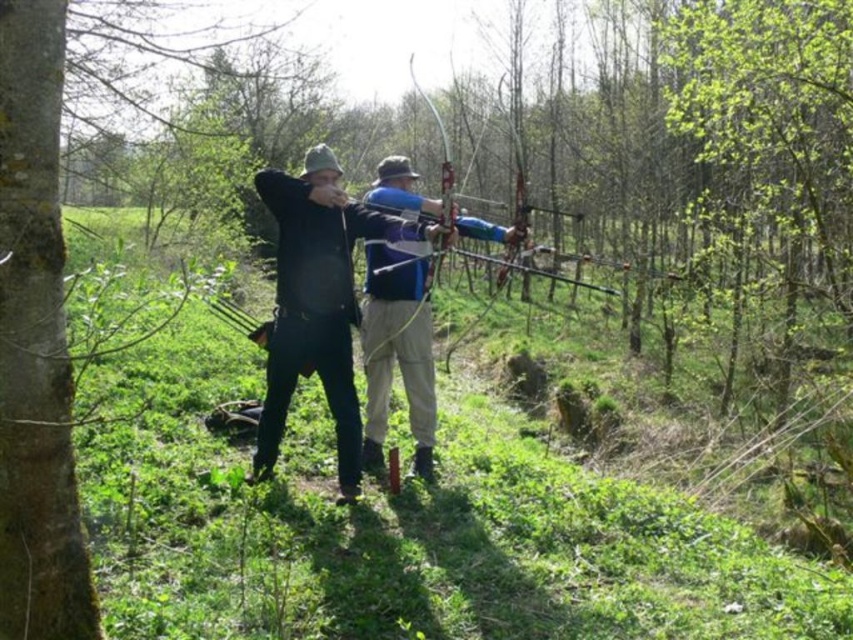
Does black matte jacket at center have a lesser width compared to matte blue bow at center?

Yes, black matte jacket at center is thinner than matte blue bow at center.

Does black matte jacket at center lie behind matte blue bow at center?

That is True.

Which is behind, point (312, 323) or point (573, 257)?

The point (573, 257) is more distant.

Find the location of a particular element. The image size is (853, 640). black matte jacket at center is located at coordinates (317, 301).

Can you confirm if blue fabric bow at center is positioned to the right of matte blue bow at center?

No, blue fabric bow at center is not to the right of matte blue bow at center.

I want to click on blue fabric bow at center, so click(x=398, y=348).

Looking at this image, is black matte jacket at center to the left of blue fabric bow at center from the viewer's perspective?

Indeed, black matte jacket at center is positioned on the left side of blue fabric bow at center.

Is black matte jacket at center shorter than blue fabric bow at center?

Indeed, black matte jacket at center has a lesser height compared to blue fabric bow at center.

Is point (316, 218) behind point (405, 348)?

No, it is not.

I want to click on black matte jacket at center, so click(317, 301).